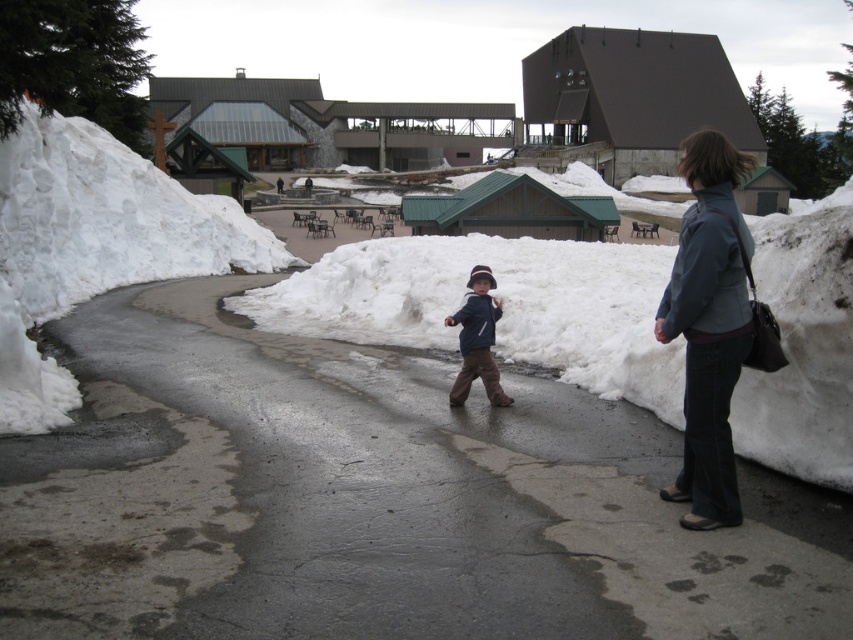
Based on the photo, is gray matte jacket at right smaller than brushed blue jacket at center?

No, gray matte jacket at right is not smaller than brushed blue jacket at center.

Who is shorter, gray matte jacket at right or brushed blue jacket at center?

brushed blue jacket at center

Based on the photo, who is more forward, (712, 253) or (460, 344)?

Point (712, 253)

Locate an element on the screen. gray matte jacket at right is located at coordinates (706, 269).

Does denim jacket at right have a lesser width compared to gray matte jacket at right?

No, denim jacket at right is not thinner than gray matte jacket at right.

Which is behind, point (706, 467) or point (701, 291)?

Point (706, 467)

Is point (709, 525) more distant than point (730, 269)?

Yes, point (709, 525) is behind point (730, 269).

Where is `denim jacket at right`? denim jacket at right is located at coordinates (708, 324).

Describe the element at coordinates (706, 269) in the screenshot. I see `gray matte jacket at right` at that location.

Can you confirm if gray matte jacket at right is positioned to the right of matte blue jacket at center?

Correct, you'll find gray matte jacket at right to the right of matte blue jacket at center.

Is point (715, 326) closer to viewer compared to point (469, 323)?

Yes.

Locate an element on the screen. The image size is (853, 640). gray matte jacket at right is located at coordinates (706, 269).